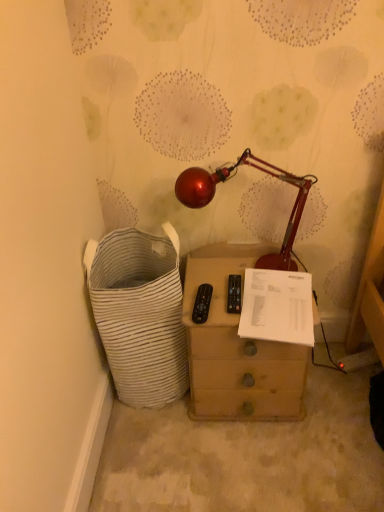
Locate an element on the screen. spots to the right of wooden chest of drawers at center is located at coordinates (337, 396).